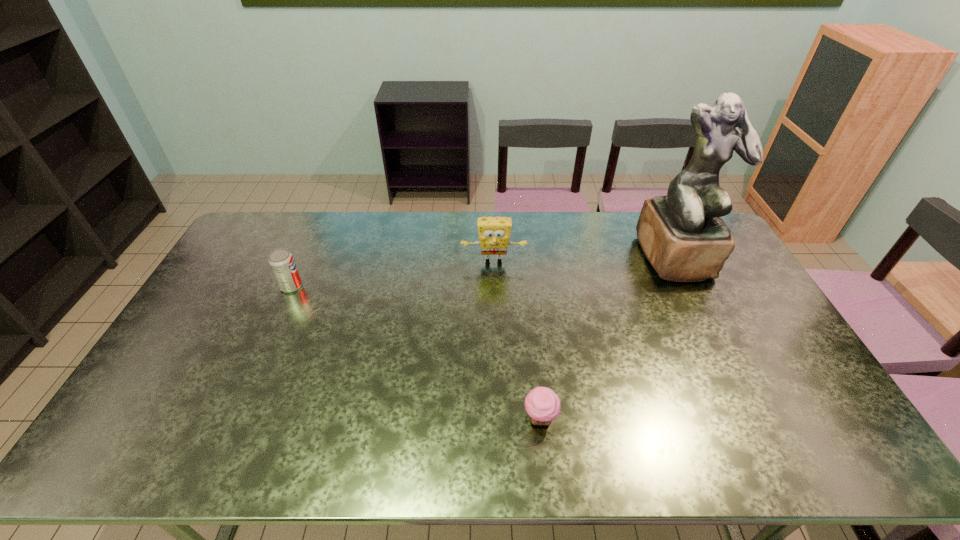
Locate an element on the screen. free space located 0.350m on the back of the nearest object is located at coordinates (528, 305).

Find the location of a particular element. object present at the far edge is located at coordinates (682, 234).

I want to click on object present at the near edge, so click(542, 404).

Identify the location of object located at the right edge. Image resolution: width=960 pixels, height=540 pixels. (682, 234).

You are a GUI agent. You are given a task and a screenshot of the screen. Output one action in this format:
    pyautogui.click(x=<x>, y=<y>)
    Task: Click on the object that is at the far right corner
    The image size is (960, 540).
    Given the screenshot: What is the action you would take?
    pyautogui.click(x=682, y=234)

I want to click on vacant area at the far edge of the desktop, so click(348, 237).

Find the location of a particular element. vacant area at the near edge is located at coordinates (552, 435).

Locate an element on the screen. This screenshot has width=960, height=540. free space at the left edge is located at coordinates (161, 407).

Identify the location of free spot at the right edge of the desktop. (749, 315).

The image size is (960, 540). Identify the location of free space at the far left corner. (263, 227).